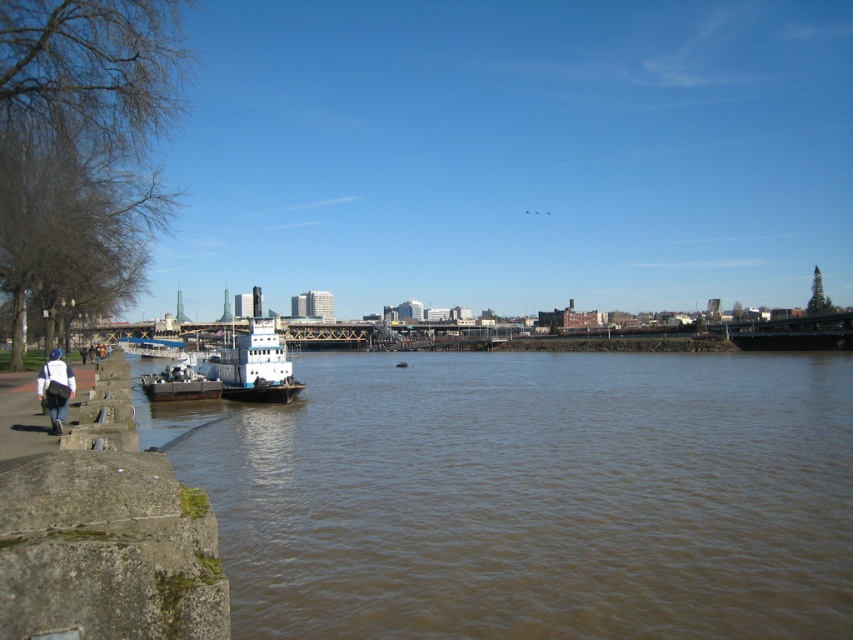
You are a delivery drone flying over the riverside scene. You need to land precisely on the matte white barge at left. What are the coordinates where you should aim to land?

The coordinates for the matte white barge at left are at point (178, 384).